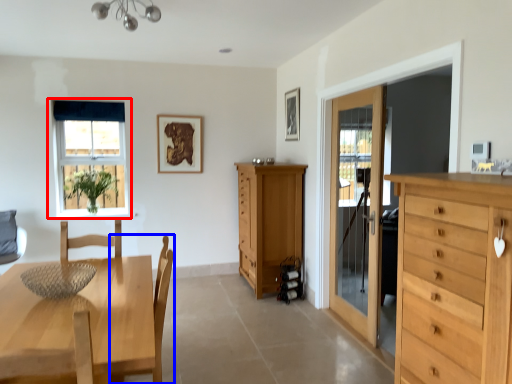
Question: Among these objects, which one is farthest to the camera, window (highlighted by a red box) or chair (highlighted by a blue box)?

Choices:
 (A) window
 (B) chair

Answer: (A)